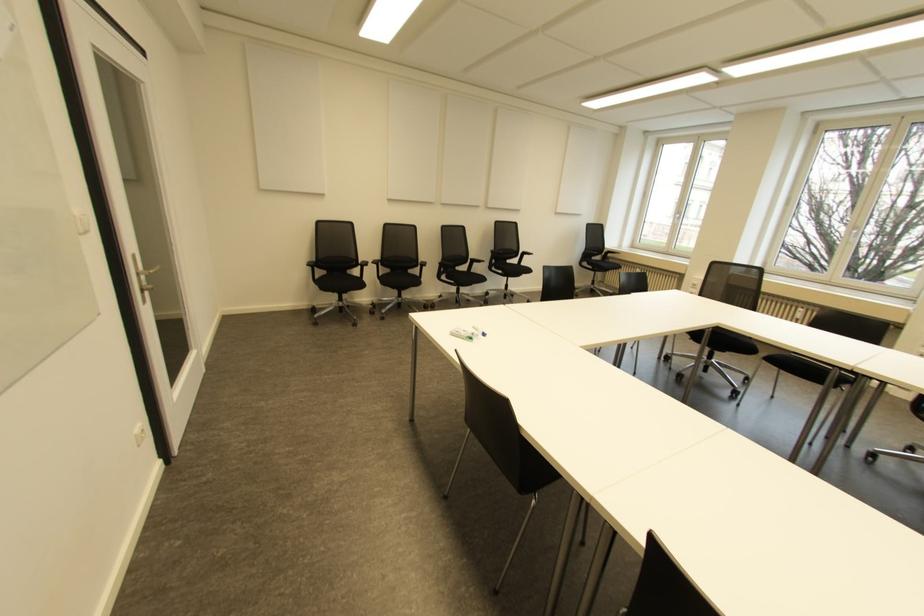
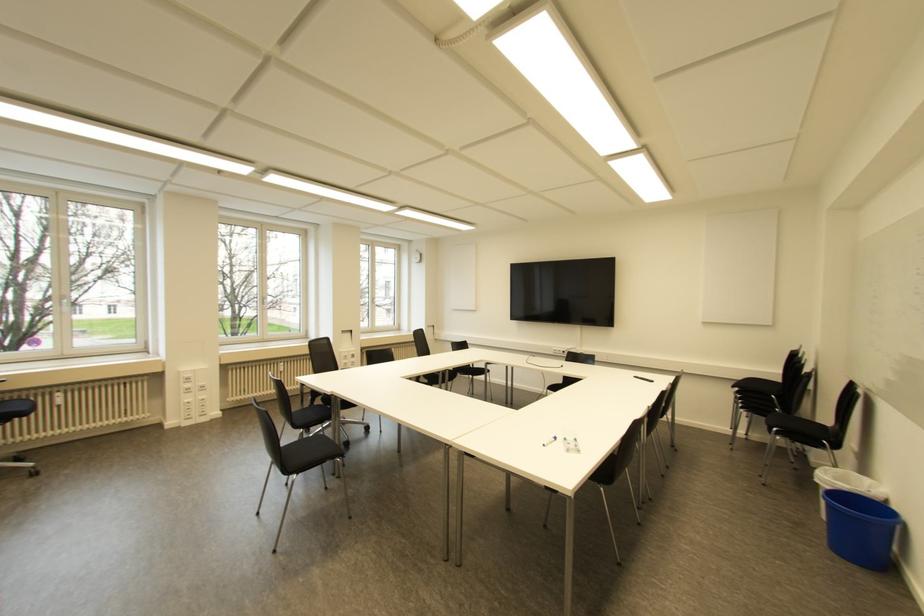
Question: I am providing you with two images of the same scene from different viewpoints. Which of the following objects are not visible in image2?

Choices:
 (A) whiteboard marker
 (B) blue plastic bin
 (C) white window handle
 (D) none of these

Answer: (D)